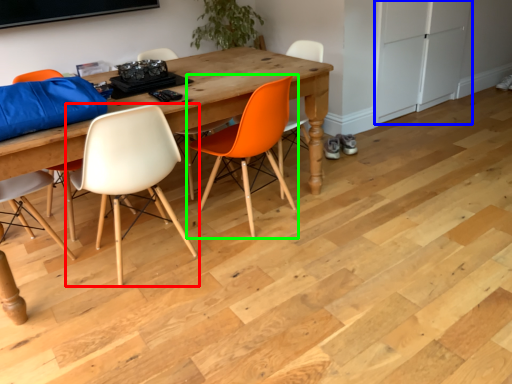
Question: Considering the real-world distances, which object is closest to chair (highlighted by a red box)? cabinetry (highlighted by a blue box) or chair (highlighted by a green box).

Choices:
 (A) cabinetry
 (B) chair

Answer: (B)